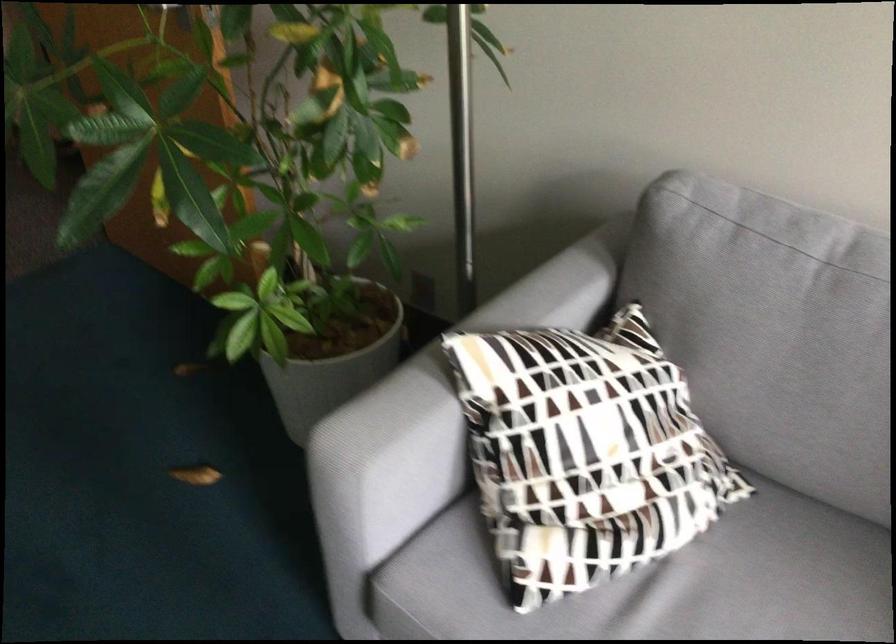
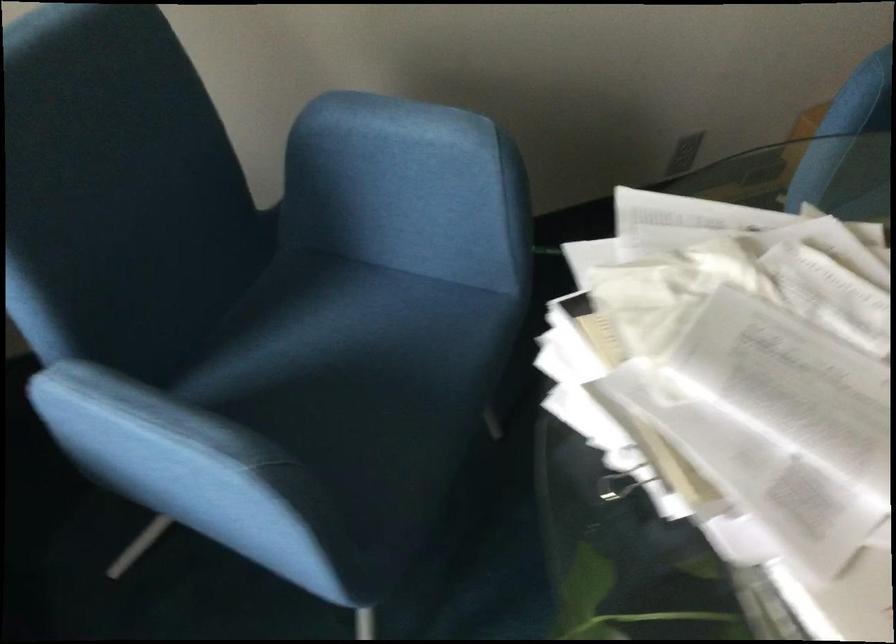
How did the camera likely rotate?

The camera's rotation is toward left-down.